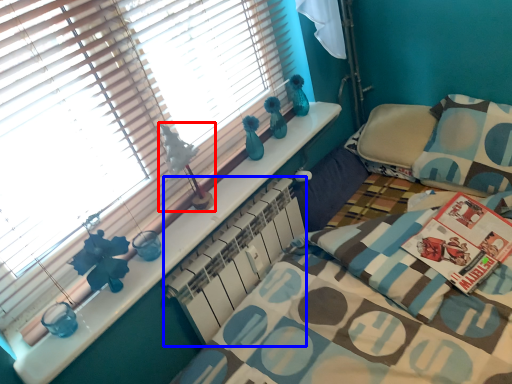
Question: Which of the following is the closest to the observer, table lamp (highlighted by a red box) or radiator (highlighted by a blue box)?

Choices:
 (A) table lamp
 (B) radiator

Answer: (A)